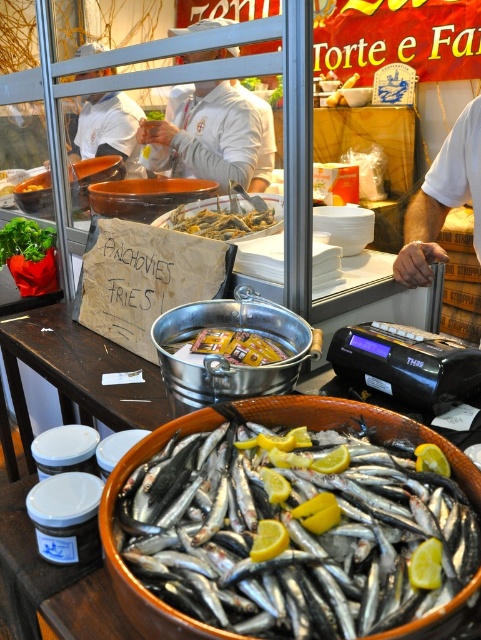
You are a customer at the fish market stall. You see the silver metallic fish at center and the yellowish plastic packet at center. Which item is bigger?

The silver metallic fish at center is larger than the yellowish plastic packet at center.

You are a customer standing at the fish market stall. You notice two points marked on the stall. Which point is closer to you, point at coordinate (166,148) or point at coordinate (227,339)?

Point at coordinate (166,148) is closer to you because it is further to the viewer than point at coordinate (227,339).

You are a customer at the fish market stall and want to know which item is higher between the white cotton shirt at center and the shiny silver anchovies at center. Which one is taller?

The white cotton shirt at center is taller than the shiny silver anchovies at center.